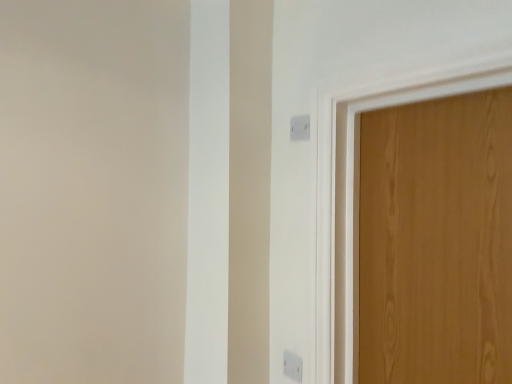
Locate an element on the screen. The height and width of the screenshot is (384, 512). white plastic light switch at upper right is located at coordinates (300, 127).

This screenshot has height=384, width=512. What do you see at coordinates (300, 127) in the screenshot? I see `white plastic light switch at upper right` at bounding box center [300, 127].

Locate an element on the screen. This screenshot has width=512, height=384. white plastic light switch at upper right is located at coordinates (300, 127).